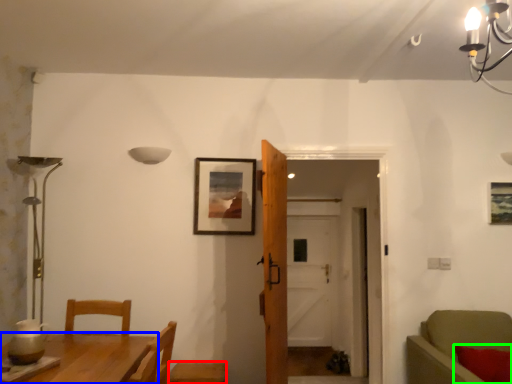
Question: Which object is positioned farthest from armchair (highlighted by a red box)? Select from table (highlighted by a blue box) and pillow (highlighted by a green box).

Choices:
 (A) table
 (B) pillow

Answer: (B)